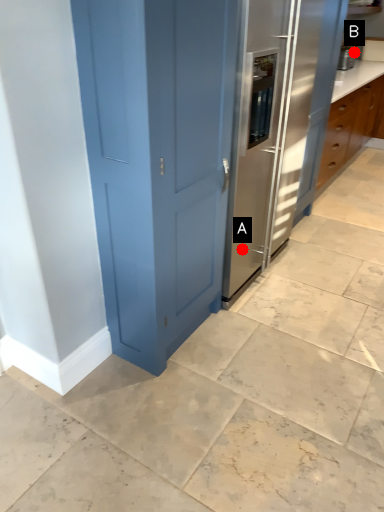
Question: Two points are circled on the image, labeled by A and B beside each circle. Which of the following is the farthest from the observer?

Choices:
 (A) A is further
 (B) B is further

Answer: (B)